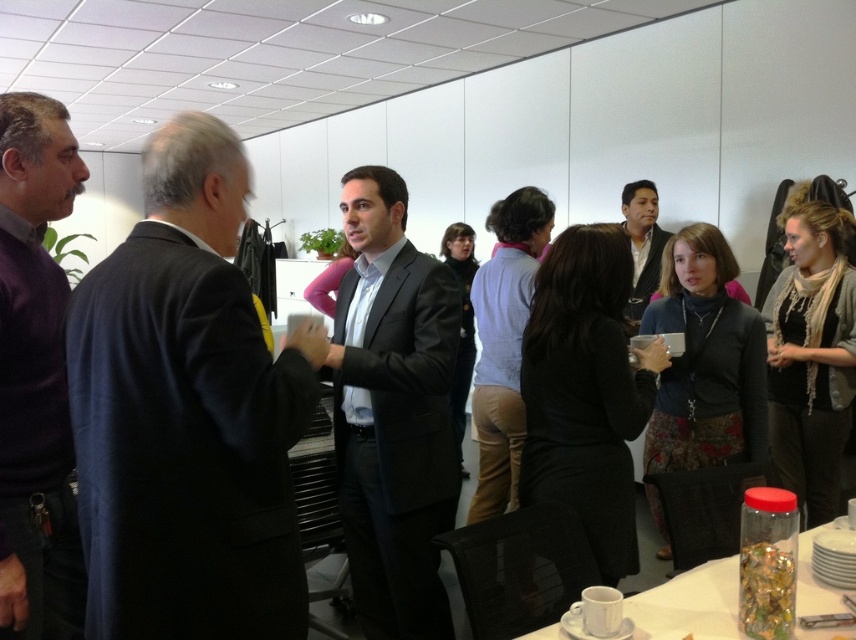
Question: Among these objects, which one is farthest from the camera?

Choices:
 (A) dark blue suit at left
 (B) dark brown leather jacket at center

Answer: (B)

Question: Considering the relative positions of purple sweater at left and dark brown leather jacket at center in the image provided, where is purple sweater at left located with respect to dark brown leather jacket at center?

Choices:
 (A) right
 (B) left

Answer: (B)

Question: Is clear plastic jar at lower right thinner than dark brown leather jacket at center?

Choices:
 (A) yes
 (B) no

Answer: (B)

Question: Observing the image, what is the correct spatial positioning of matte black suit at center in reference to clear plastic jar at lower right?

Choices:
 (A) below
 (B) above

Answer: (B)

Question: Based on their relative distances, which object is nearer to the matte black suit at center?

Choices:
 (A) dark brown leather jacket at center
 (B) clear plastic jar at lower right
 (C) purple sweater at left
 (D) dark blue suit at left

Answer: (D)

Question: Which object appears closest to the camera in this image?

Choices:
 (A) matte black suit at center
 (B) dark blue suit at left
 (C) dark brown leather jacket at center
 (D) clear plastic jar at lower right

Answer: (B)